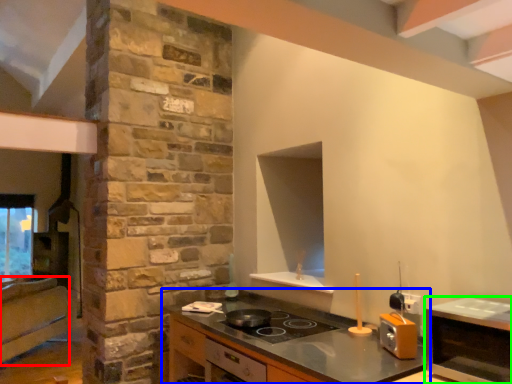
Question: Which object is positioned closest to cabinetry (highlighted by a red box)? Select from countertop (highlighted by a blue box) and microwave (highlighted by a green box).

Choices:
 (A) countertop
 (B) microwave

Answer: (A)